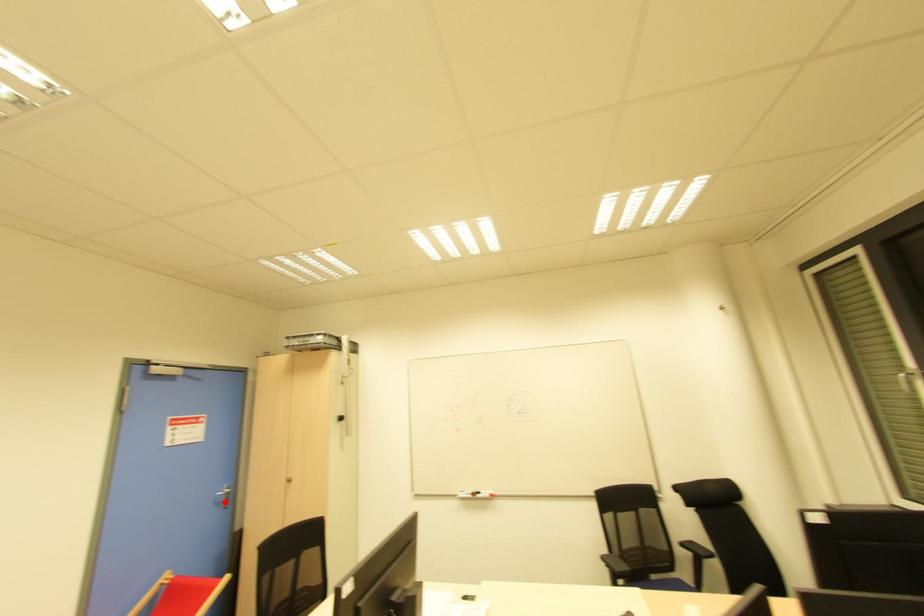
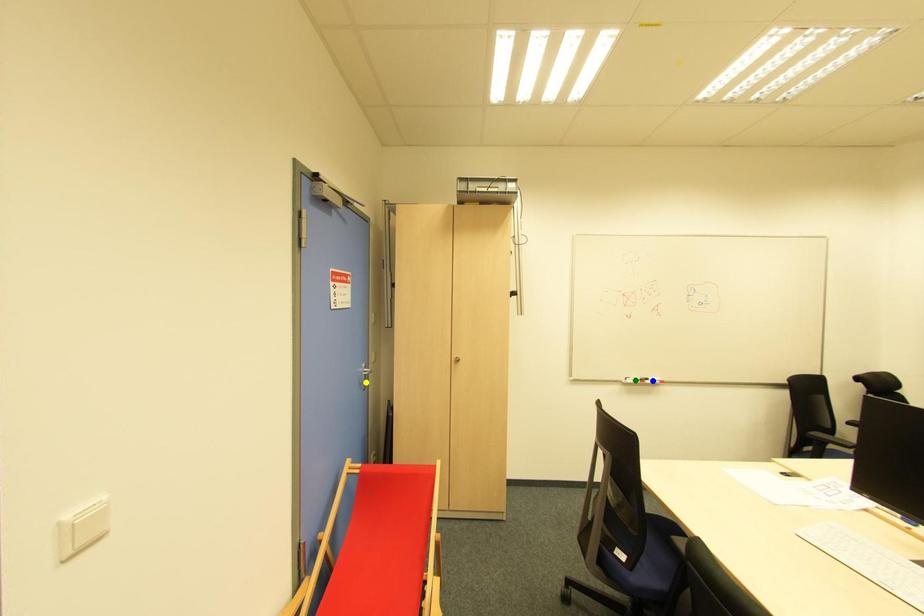
Question: I am providing you with two images of the same scene from different viewpoints. A red point is marked on the first image. You are given multiple points on the second image. In image 2, which mark is for the same physical point as the one in image 1?

Choices:
 (A) yellow point
 (B) green point
 (C) blue point

Answer: (A)